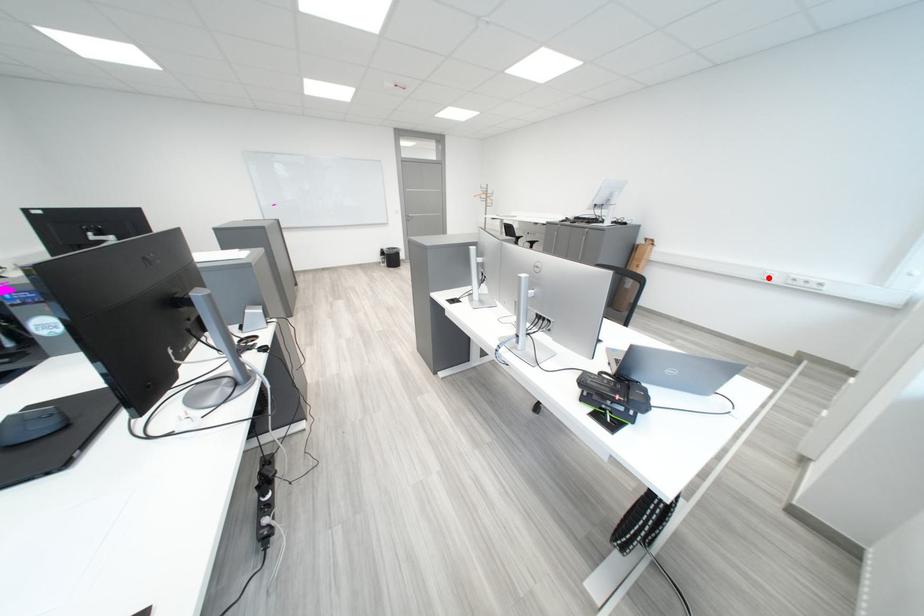
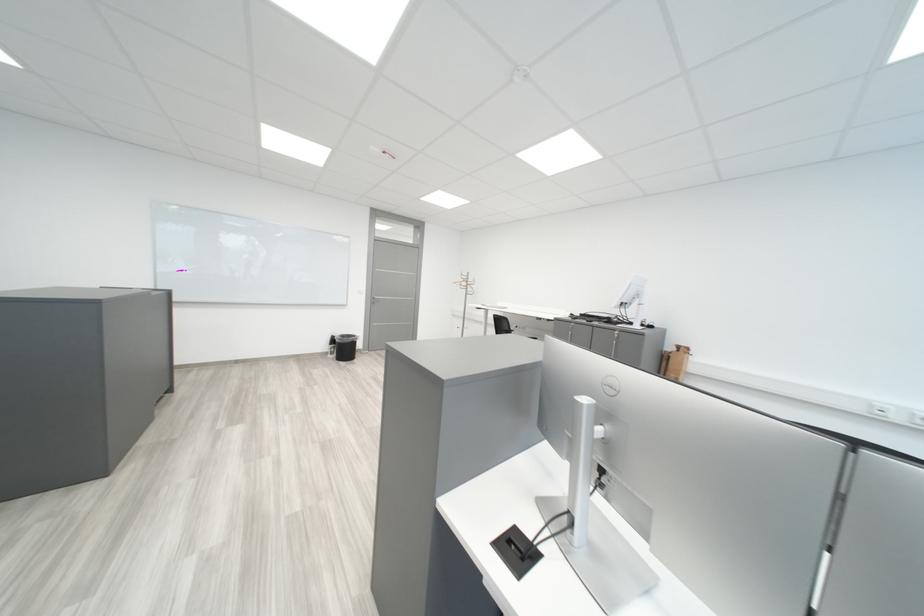
In the second image, find the point that corresponds to the highlighted location in the first image.

(870, 410)